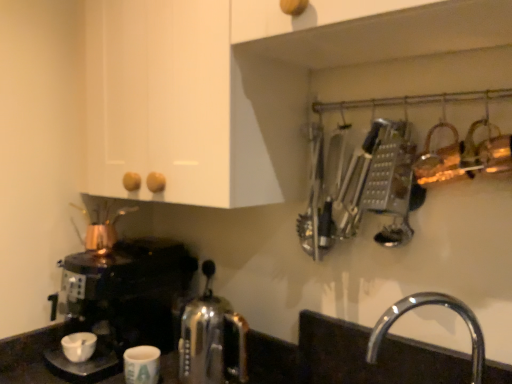
What do you see at coordinates (362, 188) in the screenshot?
I see `metallic silver grater at upper right` at bounding box center [362, 188].

What is the approximate height of metallic silver grater at upper right?

12.83 inches.

Find the location of a particular element. copper metallic tea pot at left is located at coordinates (101, 227).

Which point is more distant from viewer, (83, 351) or (408, 135)?

Point (83, 351)

Is white matte coffee cup at lower left, which appears as the second coffee cup when viewed from the right, placed right next to metallic silver grater at upper right?

white matte coffee cup at lower left, which appears as the second coffee cup when viewed from the right, and metallic silver grater at upper right are clearly separated.

From the image's perspective, between white matte coffee cup at lower left, acting as the 1th coffee cup starting from the left, and metallic silver grater at upper right, which one is located above?

metallic silver grater at upper right is shown above in the image.

Is white matte coffee cup at lower left, which appears as the second coffee cup when viewed from the right, looking in the opposite direction of metallic silver grater at upper right?

white matte coffee cup at lower left, which appears as the second coffee cup when viewed from the right, does not have its back to metallic silver grater at upper right.

This screenshot has width=512, height=384. In the image, there is a shiny black coffee maker at left. Find the location of `kitchen appliance below it (from a real-world perspective)`. kitchen appliance below it (from a real-world perspective) is located at coordinates (212, 339).

How many degrees apart are the facing directions of satin chrome kettle at center and shiny black coffee maker at left?

satin chrome kettle at center and shiny black coffee maker at left are facing 5.48 degrees away from each other.

Is satin chrome kettle at center aimed at shiny black coffee maker at left?

No, satin chrome kettle at center is not aimed at shiny black coffee maker at left.

From a real-world perspective, is satin chrome kettle at center on shiny black coffee maker at left?

No.

Is copper metallic tea pot at left not inside white matte coffee cup at lower center, arranged as the 1th coffee cup when viewed from the right?

Yes, copper metallic tea pot at left is not within white matte coffee cup at lower center, arranged as the 1th coffee cup when viewed from the right.

Considering the relative sizes of copper metallic tea pot at left and white matte coffee cup at lower center, the second coffee cup in the left-to-right sequence, in the image provided, is copper metallic tea pot at left taller than white matte coffee cup at lower center, the second coffee cup in the left-to-right sequence,?

Indeed, copper metallic tea pot at left has a greater height compared to white matte coffee cup at lower center, the second coffee cup in the left-to-right sequence.

Is copper metallic tea pot at left closer to the viewer compared to white matte coffee cup at lower center, arranged as the 1th coffee cup when viewed from the right?

No, copper metallic tea pot at left is further to the viewer.

From the picture: From a real-world perspective, who is located higher, copper metallic tea pot at left or metallic silver grater at upper right?

From a 3D spatial view, metallic silver grater at upper right is above.

From the picture: From the image's perspective, is copper metallic tea pot at left below metallic silver grater at upper right?

Indeed, from the image's perspective, copper metallic tea pot at left is shown beneath metallic silver grater at upper right.

Is there a large distance between copper metallic tea pot at left and metallic silver grater at upper right?

copper metallic tea pot at left is actually quite close to metallic silver grater at upper right.

Which is behind, point (98, 230) or point (355, 189)?

Positioned behind is point (98, 230).

Where is `cutlery on the right of shiny black coffee maker at left`? Image resolution: width=512 pixels, height=384 pixels. cutlery on the right of shiny black coffee maker at left is located at coordinates (362, 188).

Does point (136, 332) come in front of point (378, 179)?

No, (136, 332) is behind (378, 179).

Are shiny black coffee maker at left and metallic silver grater at upper right beside each other?

No, shiny black coffee maker at left is not with metallic silver grater at upper right.

From the picture: Which is correct: shiny black coffee maker at left is inside metallic silver grater at upper right, or outside of it?

shiny black coffee maker at left is spatially situated outside metallic silver grater at upper right.

Can you tell me how much metallic silver grater at upper right and shiny black coffee maker at left differ in facing direction?

The facing directions of metallic silver grater at upper right and shiny black coffee maker at left are 3.16 degrees apart.

Looking at this image, which is in front, metallic silver grater at upper right or shiny black coffee maker at left?

metallic silver grater at upper right.

Considering the sizes of objects metallic silver grater at upper right and shiny black coffee maker at left in the image provided, who is thinner, metallic silver grater at upper right or shiny black coffee maker at left?

metallic silver grater at upper right.

Find the location of a particular element. The image size is (512, 384). coffee maker on the left of metallic silver grater at upper right is located at coordinates (121, 301).

Does shiny black coffee maker at left have a smaller size compared to white matte coffee cup at lower center, arranged as the 1th coffee cup when viewed from the right?

No.

Who is taller, shiny black coffee maker at left or white matte coffee cup at lower center, arranged as the 1th coffee cup when viewed from the right?

shiny black coffee maker at left is taller.

Which is correct: shiny black coffee maker at left is inside white matte coffee cup at lower center, arranged as the 1th coffee cup when viewed from the right, or outside of it?

shiny black coffee maker at left cannot be found inside white matte coffee cup at lower center, arranged as the 1th coffee cup when viewed from the right.

The width and height of the screenshot is (512, 384). I want to click on coffee cup that appears on the right of shiny black coffee maker at left, so click(x=142, y=365).

Find the location of `cutlery above the white matte coffee cup at lower left, acting as the 1th coffee cup starting from the left (from a real-world perspective)`. cutlery above the white matte coffee cup at lower left, acting as the 1th coffee cup starting from the left (from a real-world perspective) is located at coordinates click(x=362, y=188).

This screenshot has width=512, height=384. Find the location of `coffee maker behind the satin chrome kettle at center`. coffee maker behind the satin chrome kettle at center is located at coordinates (121, 301).

Based on their spatial positions, is white matte coffee cup at lower center, the second coffee cup in the left-to-right sequence, or shiny black coffee maker at left further from white matte coffee cup at lower left, which appears as the second coffee cup when viewed from the right?

Based on the image, white matte coffee cup at lower center, the second coffee cup in the left-to-right sequence, appears to be further to white matte coffee cup at lower left, which appears as the second coffee cup when viewed from the right.

From the image, which object appears to be nearer to white matte coffee cup at lower center, the second coffee cup in the left-to-right sequence, white matte coffee cup at lower left, which appears as the second coffee cup when viewed from the right, or metallic silver grater at upper right?

Based on the image, white matte coffee cup at lower left, which appears as the second coffee cup when viewed from the right, appears to be nearer to white matte coffee cup at lower center, the second coffee cup in the left-to-right sequence.

Estimate the real-world distances between objects in this image. Which object is closer to copper metallic tea pot at left, white matte coffee cup at lower center, arranged as the 1th coffee cup when viewed from the right, or white matte coffee cup at lower left, acting as the 1th coffee cup starting from the left?

white matte coffee cup at lower left, acting as the 1th coffee cup starting from the left.

Which object lies nearer to the anchor point satin chrome kettle at center, white matte coffee cup at lower left, acting as the 1th coffee cup starting from the left, or white matte coffee cup at lower center, the second coffee cup in the left-to-right sequence?

Among the two, white matte coffee cup at lower center, the second coffee cup in the left-to-right sequence, is located nearer to satin chrome kettle at center.

Which object lies further to the anchor point chrome/metallic faucet at lower right, white matte coffee cup at lower left, which appears as the second coffee cup when viewed from the right, or white matte coffee cup at lower center, arranged as the 1th coffee cup when viewed from the right?

white matte coffee cup at lower left, which appears as the second coffee cup when viewed from the right, is positioned further to the anchor chrome/metallic faucet at lower right.

In the scene shown: Based on their spatial positions, is white matte coffee cup at lower left, which appears as the second coffee cup when viewed from the right, or chrome/metallic faucet at lower right further from copper metallic tea pot at left?

chrome/metallic faucet at lower right lies further to copper metallic tea pot at left than the other object.

Which object lies further to the anchor point white matte coffee cup at lower center, arranged as the 1th coffee cup when viewed from the right, metallic silver grater at upper right or chrome/metallic faucet at lower right?

metallic silver grater at upper right is positioned further to the anchor white matte coffee cup at lower center, arranged as the 1th coffee cup when viewed from the right.

Looking at the image, which one is located closer to chrome/metallic faucet at lower right, metallic silver grater at upper right or copper metallic tea pot at left?

The object closer to chrome/metallic faucet at lower right is metallic silver grater at upper right.

Where is `coffee cup between copper metallic tea pot at left and white matte coffee cup at lower center, the second coffee cup in the left-to-right sequence, vertically`? The width and height of the screenshot is (512, 384). coffee cup between copper metallic tea pot at left and white matte coffee cup at lower center, the second coffee cup in the left-to-right sequence, vertically is located at coordinates (79, 346).

Locate an element on the screen. cutlery between satin chrome kettle at center and chrome/metallic faucet at lower right from left to right is located at coordinates (362, 188).

Locate an element on the screen. This screenshot has width=512, height=384. cutlery situated between copper metallic tea pot at left and chrome/metallic faucet at lower right from left to right is located at coordinates click(x=362, y=188).

You are a GUI agent. You are given a task and a screenshot of the screen. Output one action in this format:
    pyautogui.click(x=<x>, y=<y>)
    Task: Click on the coffee maker situated between white matte coffee cup at lower left, acting as the 1th coffee cup starting from the left, and satin chrome kettle at center from left to right
    Image resolution: width=512 pixels, height=384 pixels.
    Given the screenshot: What is the action you would take?
    pyautogui.click(x=121, y=301)